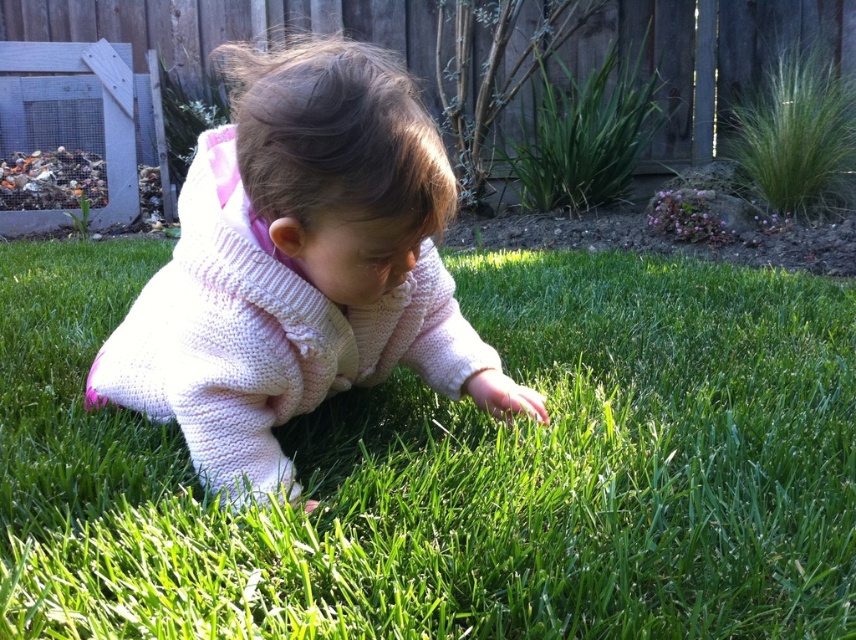
Does green grass at center have a greater width compared to knitted pink sweater at center?

Correct, the width of green grass at center exceeds that of knitted pink sweater at center.

Between green grass at center and knitted pink sweater at center, which one appears on the right side from the viewer's perspective?

Positioned to the right is green grass at center.

Who is more forward, (660, 458) or (383, 308)?

Positioned in front is point (383, 308).

Locate an element on the screen. The width and height of the screenshot is (856, 640). green grass at center is located at coordinates (455, 468).